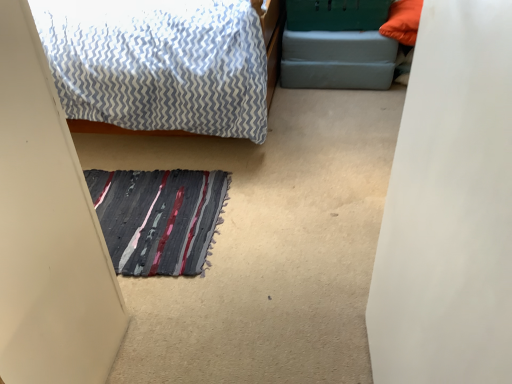
Question: From a real-world perspective, is green plastic bed frame at upper center physically located above or below textured wool doormat at center?

Choices:
 (A) above
 (B) below

Answer: (A)

Question: Would you say green plastic bed frame at upper center is to the left or to the right of textured wool doormat at center in the picture?

Choices:
 (A) right
 (B) left

Answer: (A)

Question: In terms of size, does green plastic bed frame at upper center appear bigger or smaller than textured wool doormat at center?

Choices:
 (A) big
 (B) small

Answer: (A)

Question: Looking at the image, does textured wool doormat at center seem bigger or smaller compared to green plastic bed frame at upper center?

Choices:
 (A) small
 (B) big

Answer: (A)

Question: Is textured wool doormat at center taller or shorter than green plastic bed frame at upper center?

Choices:
 (A) short
 (B) tall

Answer: (A)

Question: From a real-world perspective, is textured wool doormat at center above or below green plastic bed frame at upper center?

Choices:
 (A) below
 (B) above

Answer: (A)

Question: Is textured wool doormat at center to the left or to the right of green plastic bed frame at upper center in the image?

Choices:
 (A) left
 (B) right

Answer: (A)